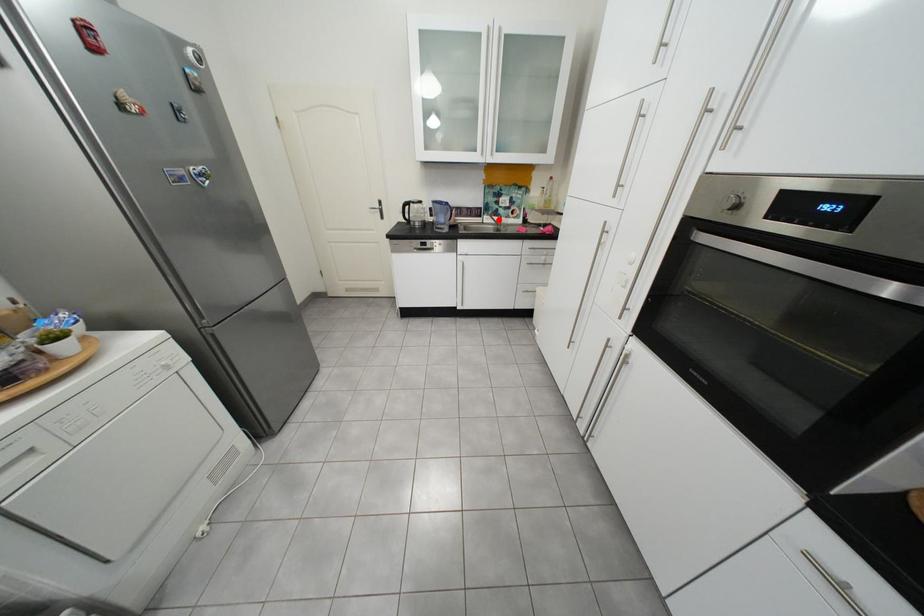
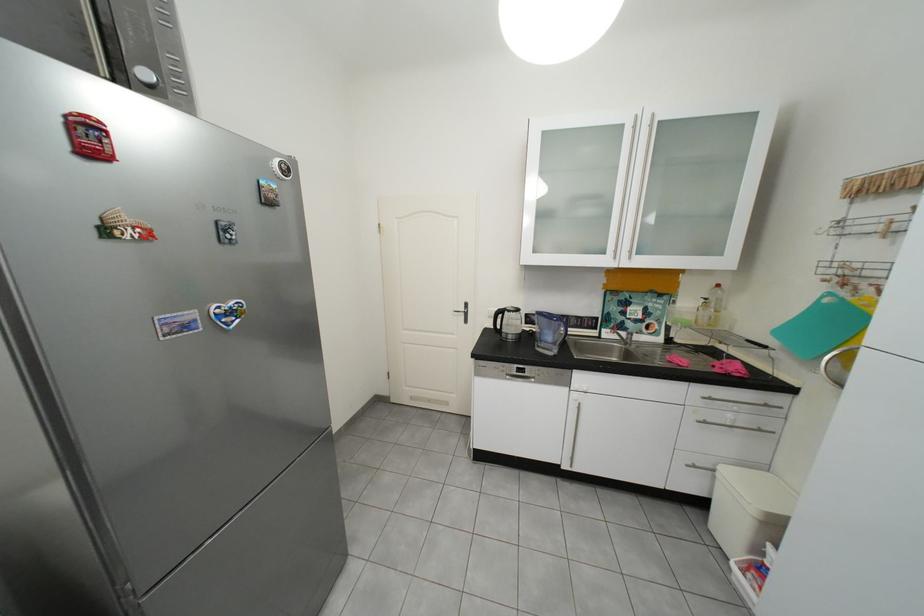
Question: I am providing you with two images of the same scene from different viewpoints. In image1, a red point is highlighted. Considering the same 3D point in image2, which of the following is correct?

Choices:
 (A) It is closer
 (B) It is farther

Answer: (B)